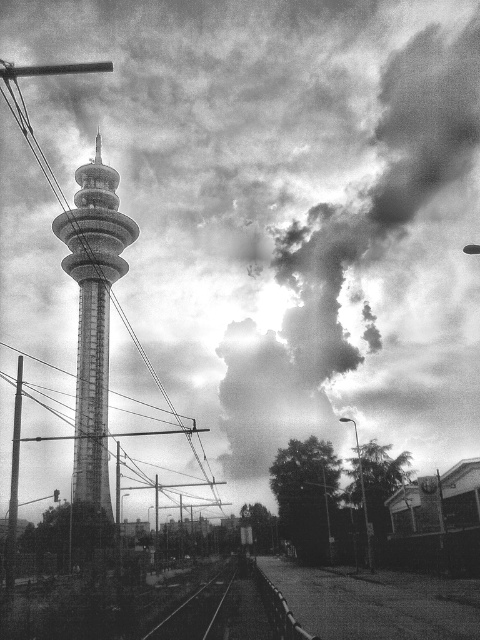
Question: Does smooth wire at center appear on the left side of smooth metallic tower at center?

Choices:
 (A) yes
 (B) no

Answer: (A)

Question: Which object appears closest to the camera in this image?

Choices:
 (A) smooth wire at center
 (B) smooth metal train track at lower center
 (C) smooth metallic tower at center

Answer: (A)

Question: Does smooth wire at center appear under smooth metallic tower at center?

Choices:
 (A) yes
 (B) no

Answer: (A)

Question: Which object is closer to the camera taking this photo?

Choices:
 (A) smooth metallic tower at center
 (B) smooth wire at center

Answer: (B)

Question: Which object is closer to the camera taking this photo?

Choices:
 (A) smooth metal train track at lower center
 (B) smooth wire at center

Answer: (B)

Question: Is smooth wire at center positioned at the back of smooth metallic tower at center?

Choices:
 (A) no
 (B) yes

Answer: (A)